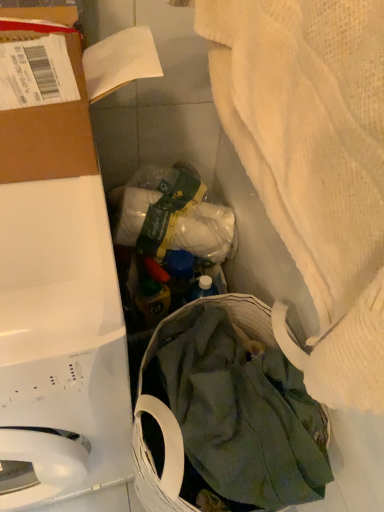
Measure the distance between green cotton cloth at lower center and camera.

The distance of green cotton cloth at lower center from camera is 25.11 inches.

The image size is (384, 512). I want to click on green cotton cloth at lower center, so click(x=244, y=416).

At what (x,y) coordinates should I click in order to perform the action: click on white fabric at center. Please return your answer as a coordinate pair (x, y). Image resolution: width=384 pixels, height=512 pixels. Looking at the image, I should click on (169, 231).

The image size is (384, 512). What are the coordinates of `white glossy washing machine at left` in the screenshot? It's located at (61, 341).

From a real-world perspective, who is located lower, brown cardboard at upper left or white textured towel at upper right?

In real-world perspective, brown cardboard at upper left is lower.

Does brown cardboard at upper left have a smaller size compared to white textured towel at upper right?

Yes.

Is brown cardboard at upper left positioned with its back to white textured towel at upper right?

That's not correct — brown cardboard at upper left is not looking away from white textured towel at upper right.

You are a GUI agent. You are given a task and a screenshot of the screen. Output one action in this format:
    pyautogui.click(x=<x>, y=<y>)
    Task: Click on the blanket on the right of brown cardboard at upper left
    
    Given the screenshot: What is the action you would take?
    pyautogui.click(x=314, y=164)

Can you see white textured towel at upper right touching green cotton cloth at lower center?

No, white textured towel at upper right is not in contact with green cotton cloth at lower center.

Considering the relative sizes of white textured towel at upper right and green cotton cloth at lower center in the image provided, is white textured towel at upper right wider than green cotton cloth at lower center?

Incorrect, the width of white textured towel at upper right does not surpass that of green cotton cloth at lower center.

Consider the image. Measure the distance from white textured towel at upper right to green cotton cloth at lower center.

14.78 inches.

Where is `blanket that appears above the green cotton cloth at lower center (from a real-world perspective)`? The image size is (384, 512). blanket that appears above the green cotton cloth at lower center (from a real-world perspective) is located at coordinates (314, 164).

Do you think green cotton cloth at lower center is within white glossy washing machine at left, or outside of it?

The correct answer is: outside.

Locate an element on the screen. clothing located behind the white glossy washing machine at left is located at coordinates (244, 416).

Considering the positions of objects green cotton cloth at lower center and white glossy washing machine at left in the image provided, who is more to the right, green cotton cloth at lower center or white glossy washing machine at left?

From the viewer's perspective, green cotton cloth at lower center appears more on the right side.

Considering the relative sizes of green cotton cloth at lower center and white glossy washing machine at left in the image provided, is green cotton cloth at lower center wider than white glossy washing machine at left?

No.

Does white fabric at center have a lesser width compared to white textured towel at upper right?

No.

Can you confirm if white fabric at center is smaller than white textured towel at upper right?

Correct, white fabric at center occupies less space than white textured towel at upper right.

Are white fabric at center and white textured towel at upper right far apart?

No, white fabric at center is not far away from white textured towel at upper right.

Considering the positions of points (134, 309) and (318, 3), is point (134, 309) farther from camera compared to point (318, 3)?

Yes, it is.

Is point (1, 386) positioned after point (159, 226)?

No, (1, 386) is closer to viewer.

Between white glossy washing machine at left and white fabric at center, which one has more height?

Standing taller between the two is white glossy washing machine at left.

From the image's perspective, who appears lower, white glossy washing machine at left or white fabric at center?

white glossy washing machine at left.

From a real-world perspective, which is physically below, white glossy washing machine at left or brown cardboard at upper left?

In real-world perspective, white glossy washing machine at left is lower.

Does white glossy washing machine at left appear on the right side of brown cardboard at upper left?

In fact, white glossy washing machine at left is to the left of brown cardboard at upper left.

Does point (66, 490) come closer to viewer compared to point (24, 127)?

No, it is behind (24, 127).

From the picture: From the image's perspective, between white glossy washing machine at left and brown cardboard at upper left, who is located below?

white glossy washing machine at left appears lower in the image.

Between white fabric at center and green cotton cloth at lower center, which one is positioned in front?

green cotton cloth at lower center is in front.

In the scene shown: From a real-world perspective, who is located higher, white fabric at center or green cotton cloth at lower center?

In real-world perspective, white fabric at center is above.

Identify the location of blanket on the right of the brown cardboard at upper left. (314, 164).

Where is `clothing below the white textured towel at upper right (from the image's perspective)`? The width and height of the screenshot is (384, 512). clothing below the white textured towel at upper right (from the image's perspective) is located at coordinates (244, 416).

Looking at the image, which one is located closer to white glossy washing machine at left, white fabric at center or white textured towel at upper right?

Based on the image, white textured towel at upper right appears to be nearer to white glossy washing machine at left.

Based on their spatial positions, is white textured towel at upper right or white glossy washing machine at left further from brown cardboard at upper left?

Based on the image, white glossy washing machine at left appears to be further to brown cardboard at upper left.

When comparing their distances from white fabric at center, does white glossy washing machine at left or white textured towel at upper right seem further?

The object further to white fabric at center is white textured towel at upper right.

Considering their positions, is white fabric at center positioned closer to green cotton cloth at lower center than white textured towel at upper right?

white fabric at center lies closer to green cotton cloth at lower center than the other object.

Based on their spatial positions, is white glossy washing machine at left or green cotton cloth at lower center closer to white textured towel at upper right?

The object closer to white textured towel at upper right is white glossy washing machine at left.

Considering their positions, is brown cardboard at upper left positioned further to white textured towel at upper right than green cotton cloth at lower center?

green cotton cloth at lower center lies further to white textured towel at upper right than the other object.

From the image, which object appears to be farther from brown cardboard at upper left, white fabric at center or white textured towel at upper right?

white fabric at center is positioned further to the anchor brown cardboard at upper left.

From the image, which object appears to be nearer to green cotton cloth at lower center, white textured towel at upper right or white glossy washing machine at left?

white glossy washing machine at left is positioned closer to the anchor green cotton cloth at lower center.

Identify the location of washing machine between brown cardboard at upper left and green cotton cloth at lower center from top to bottom. (61, 341).

At what (x,y) coordinates should I click in order to perform the action: click on cardboard box between white glossy washing machine at left and white fabric at center in the front-back direction. Please return your answer as a coordinate pair (x, y). This screenshot has width=384, height=512. Looking at the image, I should click on (49, 135).

This screenshot has width=384, height=512. I want to click on washing machine located between white textured towel at upper right and white fabric at center in the depth direction, so click(x=61, y=341).

This screenshot has width=384, height=512. I want to click on clothing positioned between white textured towel at upper right and white fabric at center from near to far, so click(x=244, y=416).